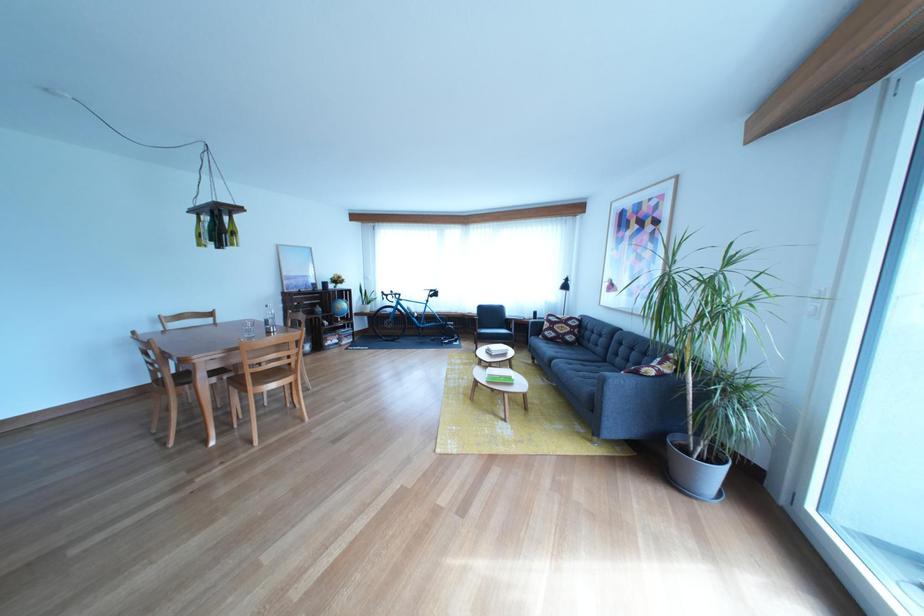
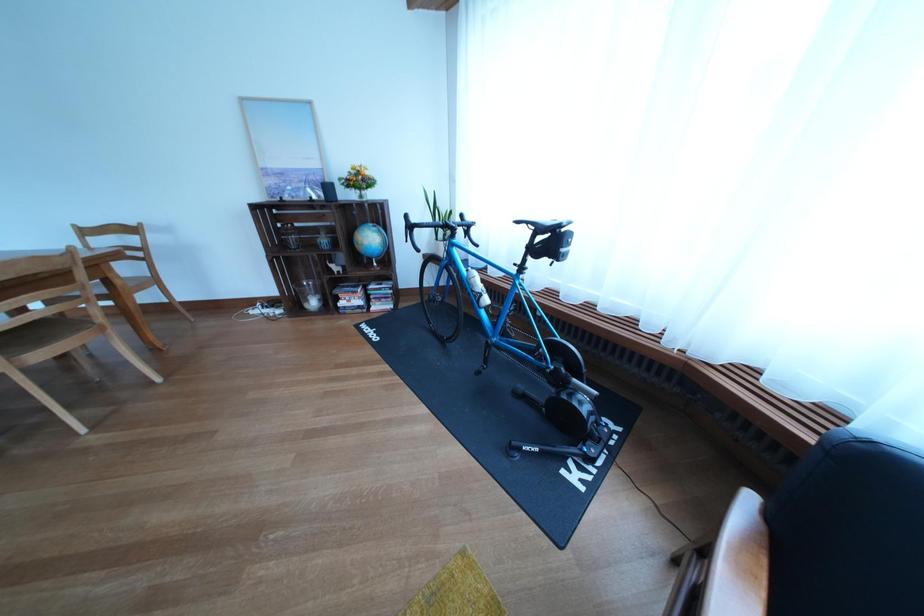
The point at (357, 312) is marked in the first image. Where is the corresponding point in the second image?

(383, 244)